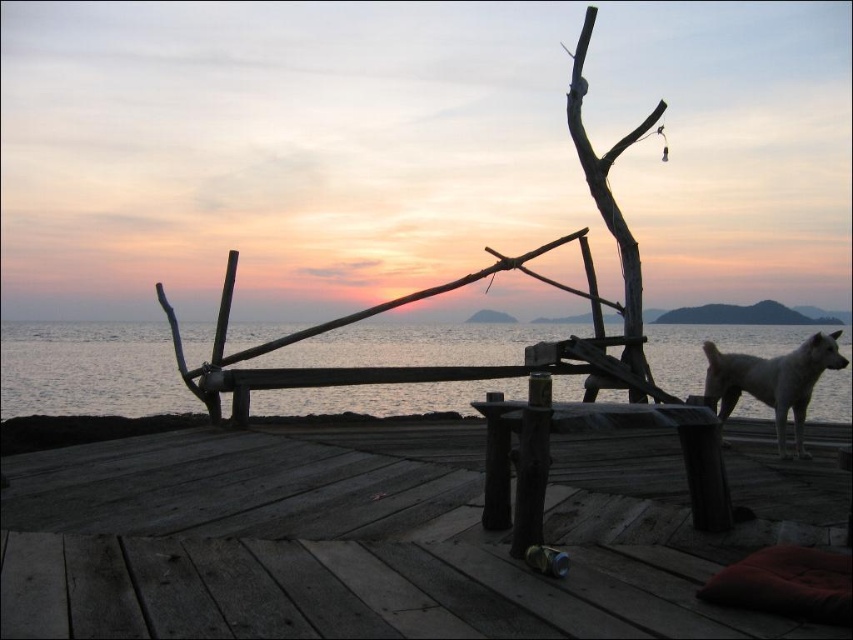
Question: Does smooth water at center have a lesser width compared to wooden picnic table at center?

Choices:
 (A) no
 (B) yes

Answer: (A)

Question: Which object is farther from the camera taking this photo?

Choices:
 (A) wooden at center
 (B) white fur dog at right
 (C) smooth water at center

Answer: (B)

Question: Does wooden at center have a lesser width compared to smooth water at center?

Choices:
 (A) yes
 (B) no

Answer: (A)

Question: Among these objects, which one is farthest from the camera?

Choices:
 (A) wooden picnic table at center
 (B) smooth water at center

Answer: (B)

Question: Which of the following is the farthest from the observer?

Choices:
 (A) wooden at center
 (B) smooth water at center
 (C) white fur dog at right
 (D) wooden picnic table at center

Answer: (C)

Question: Does wooden picnic table at center have a greater width compared to white fur dog at right?

Choices:
 (A) no
 (B) yes

Answer: (B)